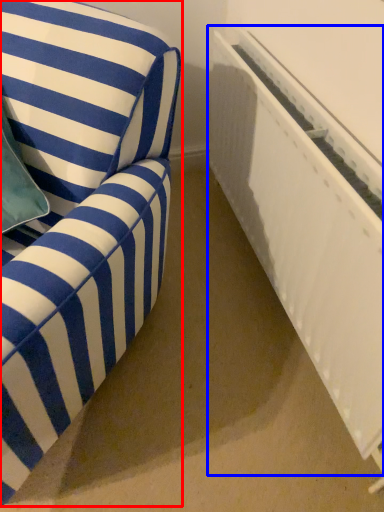
Question: Which object appears farthest to the camera in this image, furniture (highlighted by a red box) or radiator (highlighted by a blue box)?

Choices:
 (A) furniture
 (B) radiator

Answer: (B)